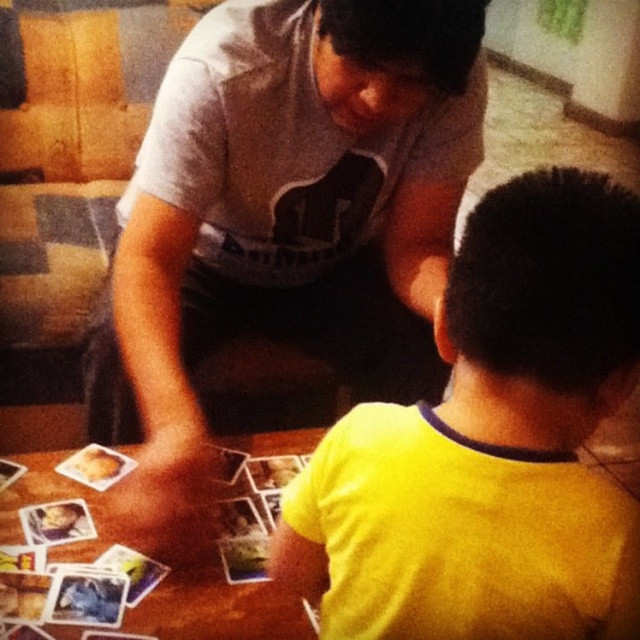
Based on the photo, who is positioned more to the left, yellow matte shirt at lower right or wooden table at lower left?

Positioned to the left is wooden table at lower left.

Does yellow matte shirt at lower right appear on the left side of wooden table at lower left?

Incorrect, yellow matte shirt at lower right is not on the left side of wooden table at lower left.

Is point (372, 419) closer to viewer compared to point (4, 534)?

Yes, it is.

What are the coordinates of `yellow matte shirt at lower right` in the screenshot? It's located at (490, 444).

Is gray cotton shirt at upper center positioned at the back of yellow matte shirt at lower right?

Yes, it is behind yellow matte shirt at lower right.

Does point (300, 109) come in front of point (580, 195)?

No, it is behind (580, 195).

Is point (332, 45) closer to camera compared to point (488, 541)?

That is False.

Identify the location of gray cotton shirt at upper center. (278, 202).

Is point (193, 109) positioned in front of point (276, 595)?

No.

Between gray cotton shirt at upper center and wooden table at lower left, which one has less height?

wooden table at lower left

Between point (344, 166) and point (20, 538), which one is positioned in front?

Point (20, 538) is in front.

At what (x,y) coordinates should I click in order to perform the action: click on gray cotton shirt at upper center. Please return your answer as a coordinate pair (x, y). The width and height of the screenshot is (640, 640). Looking at the image, I should click on (278, 202).